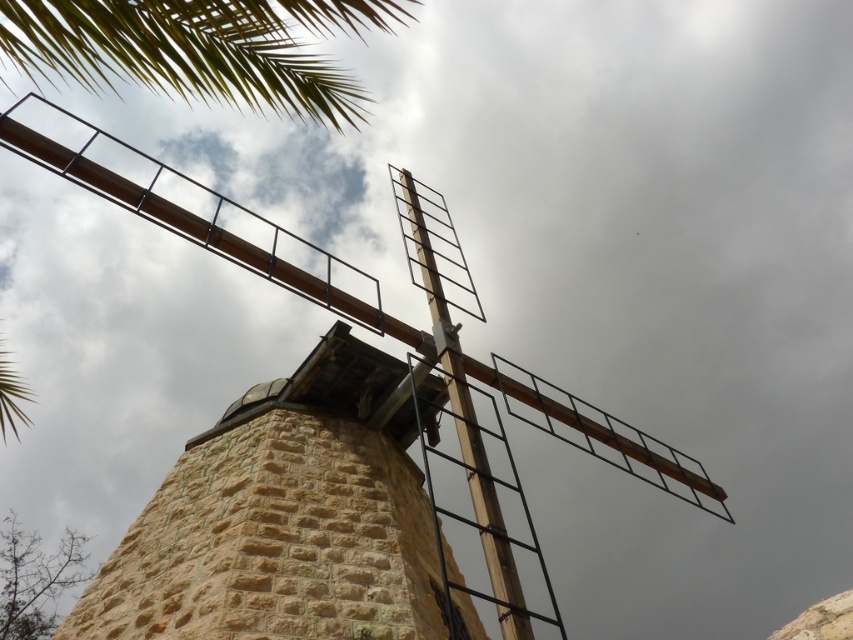
Question: Where is stone textured tower at center located in relation to green leafy palm at upper left in the image?

Choices:
 (A) below
 (B) above

Answer: (A)

Question: Among these points, which one is nearest to the camera?

Choices:
 (A) (384, 532)
 (B) (236, 13)

Answer: (B)

Question: Where is stone textured tower at center located in relation to wooden windmill at center in the image?

Choices:
 (A) left
 (B) right

Answer: (B)

Question: Which of the following is the farthest from the observer?

Choices:
 (A) wooden windmill at center
 (B) stone textured tower at center
 (C) green leafy palm at upper left

Answer: (B)

Question: From the image, what is the correct spatial relationship of wooden windmill at center in relation to green leafy palm at upper left?

Choices:
 (A) above
 (B) below

Answer: (B)

Question: Which object is positioned closest to the wooden windmill at center?

Choices:
 (A) stone textured tower at center
 (B) green leafy palm at upper left

Answer: (B)